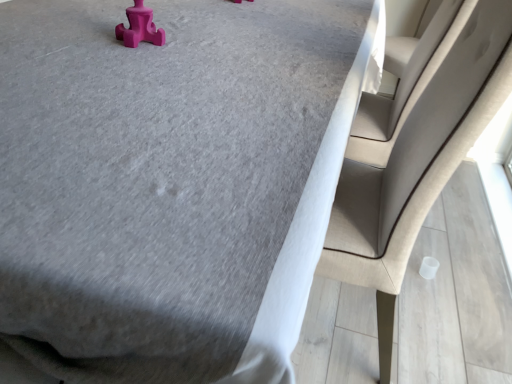
Question: From a real-world perspective, is pink rubber toy at upper left physically located above or below beige fabric chair at right?

Choices:
 (A) below
 (B) above

Answer: (B)

Question: Would you say pink rubber toy at upper left is to the left or to the right of beige fabric chair at right in the picture?

Choices:
 (A) left
 (B) right

Answer: (A)

Question: Is pink rubber toy at upper left inside or outside of beige fabric chair at right?

Choices:
 (A) inside
 (B) outside

Answer: (B)

Question: Looking at their shapes, would you say beige fabric chair at right is wider or thinner than pink rubber toy at upper left?

Choices:
 (A) thin
 (B) wide

Answer: (B)

Question: Is beige fabric chair at right inside or outside of pink rubber toy at upper left?

Choices:
 (A) inside
 (B) outside

Answer: (B)

Question: Considering the positions of beige fabric chair at right and pink rubber toy at upper left in the image, is beige fabric chair at right taller or shorter than pink rubber toy at upper left?

Choices:
 (A) tall
 (B) short

Answer: (A)

Question: In the image, is beige fabric chair at right on the left side or the right side of pink rubber toy at upper left?

Choices:
 (A) left
 (B) right

Answer: (B)